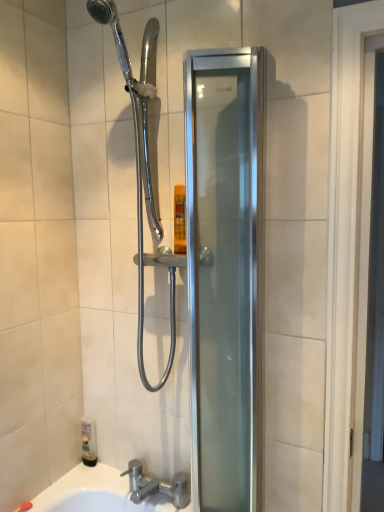
Question: Is silver metallic faucet at lower center smaller than translucent plastic bottle at lower left?

Choices:
 (A) no
 (B) yes

Answer: (A)

Question: Is silver metallic faucet at lower center placed right next to translucent plastic bottle at lower left?

Choices:
 (A) no
 (B) yes

Answer: (A)

Question: From the image's perspective, is silver metallic faucet at lower center under translucent plastic bottle at lower left?

Choices:
 (A) no
 (B) yes

Answer: (B)

Question: Does silver metallic faucet at lower center lie in front of translucent plastic bottle at lower left?

Choices:
 (A) no
 (B) yes

Answer: (B)

Question: Can you confirm if silver metallic faucet at lower center is bigger than translucent plastic bottle at lower left?

Choices:
 (A) no
 (B) yes

Answer: (B)

Question: Does silver metallic faucet at lower center turn towards translucent plastic bottle at lower left?

Choices:
 (A) no
 (B) yes

Answer: (A)

Question: Considering the relative sizes of satin silver glass shower door at center and silver metallic faucet at lower center in the image provided, is satin silver glass shower door at center thinner than silver metallic faucet at lower center?

Choices:
 (A) no
 (B) yes

Answer: (B)

Question: Considering the relative sizes of satin silver glass shower door at center and silver metallic faucet at lower center in the image provided, is satin silver glass shower door at center shorter than silver metallic faucet at lower center?

Choices:
 (A) yes
 (B) no

Answer: (B)

Question: Could you tell me if satin silver glass shower door at center is facing silver metallic faucet at lower center?

Choices:
 (A) yes
 (B) no

Answer: (B)

Question: Is the position of satin silver glass shower door at center more distant than that of silver metallic faucet at lower center?

Choices:
 (A) yes
 (B) no

Answer: (B)

Question: Does satin silver glass shower door at center have a greater height compared to silver metallic faucet at lower center?

Choices:
 (A) no
 (B) yes

Answer: (B)

Question: From the image's perspective, is satin silver glass shower door at center located beneath silver metallic faucet at lower center?

Choices:
 (A) yes
 (B) no

Answer: (B)

Question: Does translucent plastic bottle at lower left appear on the left side of satin silver glass shower door at center?

Choices:
 (A) yes
 (B) no

Answer: (A)